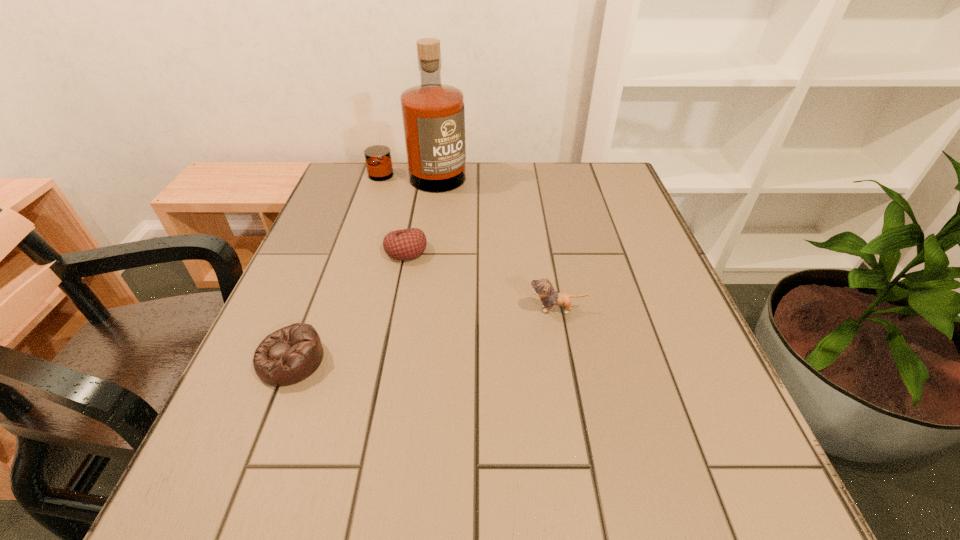
You are a GUI agent. You are given a task and a screenshot of the screen. Output one action in this format:
    pyautogui.click(x=<x>, y=<y>)
    Task: Click on the liquor
    This screenshot has width=960, height=540.
    Given the screenshot: What is the action you would take?
    pyautogui.click(x=433, y=114)

The width and height of the screenshot is (960, 540). I want to click on the farthest object, so click(x=433, y=114).

I want to click on the rightmost object, so click(x=543, y=288).

Locate an element on the screen. The image size is (960, 540). the second nearest object is located at coordinates (543, 288).

Locate an element on the screen. The width and height of the screenshot is (960, 540). the right beanbag is located at coordinates (x=407, y=244).

Locate an element on the screen. the farther beanbag is located at coordinates (407, 244).

Image resolution: width=960 pixels, height=540 pixels. In order to click on the nearest object in this screenshot , I will do `click(289, 355)`.

Find the location of `the nearer beanbag`. the nearer beanbag is located at coordinates (289, 355).

Locate an element on the screen. Image resolution: width=960 pixels, height=540 pixels. blank space located on the front label of the farthest object is located at coordinates (406, 227).

Locate an element on the screen. The width and height of the screenshot is (960, 540). vacant region located on the front-facing side of the rightmost object is located at coordinates (366, 309).